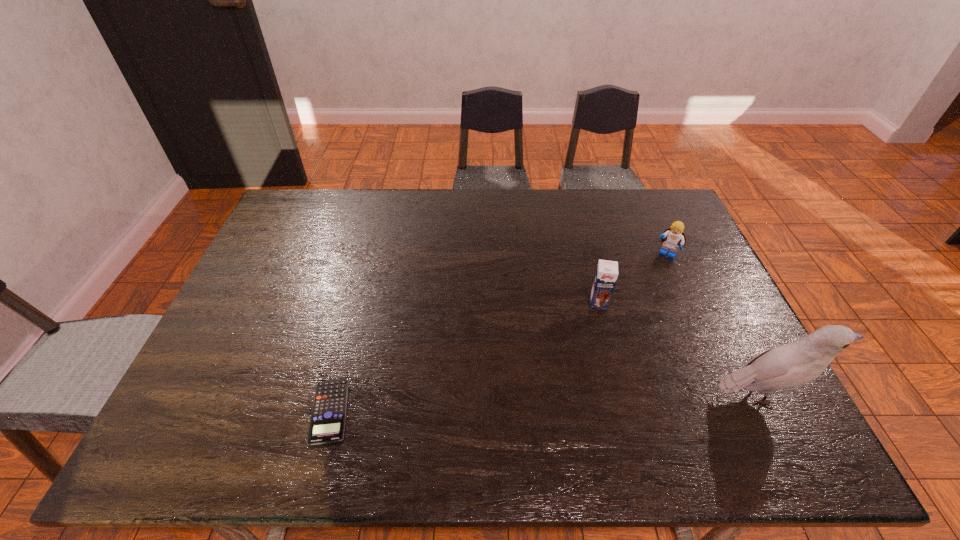
Where is `free space on the desktop that is between the calculator and the tallest object and is positioned on the front label of the second tallest object`? The height and width of the screenshot is (540, 960). free space on the desktop that is between the calculator and the tallest object and is positioned on the front label of the second tallest object is located at coordinates pos(598,401).

Locate an element on the screen. Image resolution: width=960 pixels, height=540 pixels. free space on the desktop that is between the calculator and the tallest object and is positioned on the front-facing side of the farthest object is located at coordinates (588, 401).